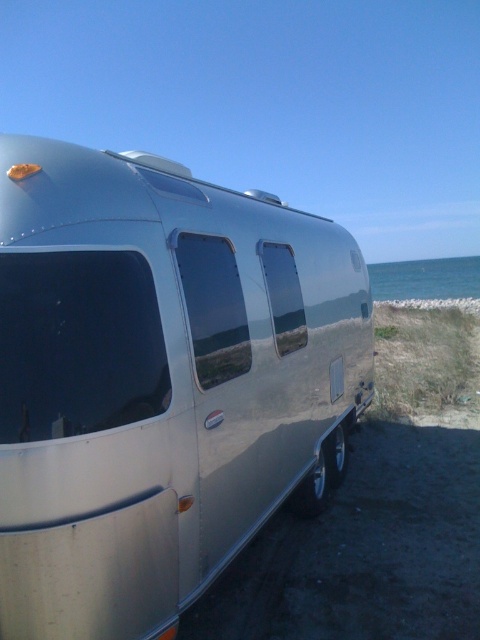
You are standing in front of the silver Airstream trailer and want to know which of the two points, point [60,317] or point [423,264], is closer to you. Based on the scene, can you determine which point is nearer?

Point [60,317] is closer to the camera than point [423,264], so it is the nearer point.

You are planning to set up a tent near the silver metallic trailer at center and the blue water at right. Based on their positions, which object is closer to the shore?

The silver metallic trailer at center is positioned under blue water at right, so the blue water at right is closer to the shore than the trailer.